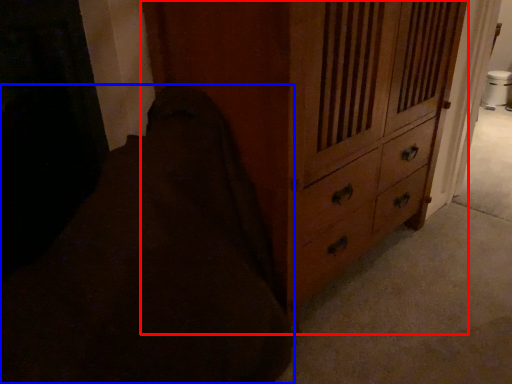
Question: Which object is further to the camera taking this photo, chest of drawers (highlighted by a red box) or bedding (highlighted by a blue box)?

Choices:
 (A) chest of drawers
 (B) bedding

Answer: (A)